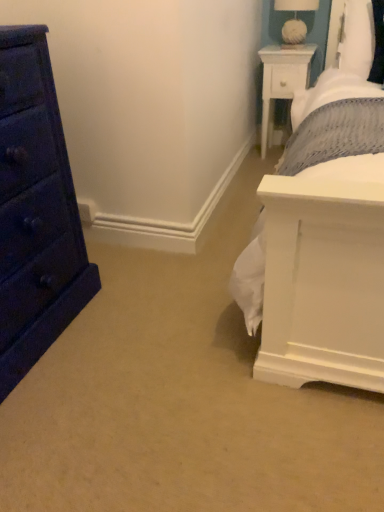
Question: Do you think matte dark blue dresser at left is within white fabric-covered lampshade at upper right, or outside of it?

Choices:
 (A) outside
 (B) inside

Answer: (A)

Question: From a real-world perspective, is matte dark blue dresser at left physically located above or below white fabric-covered lampshade at upper right?

Choices:
 (A) below
 (B) above

Answer: (A)

Question: Estimate the real-world distances between objects in this image. Which object is closer to the white fabric-covered lampshade at upper right?

Choices:
 (A) matte dark blue dresser at left
 (B) white wood nightstand at upper right

Answer: (B)

Question: Estimate the real-world distances between objects in this image. Which object is closer to the white fabric-covered lampshade at upper right?

Choices:
 (A) white wood nightstand at upper right
 (B) matte dark blue dresser at left

Answer: (A)